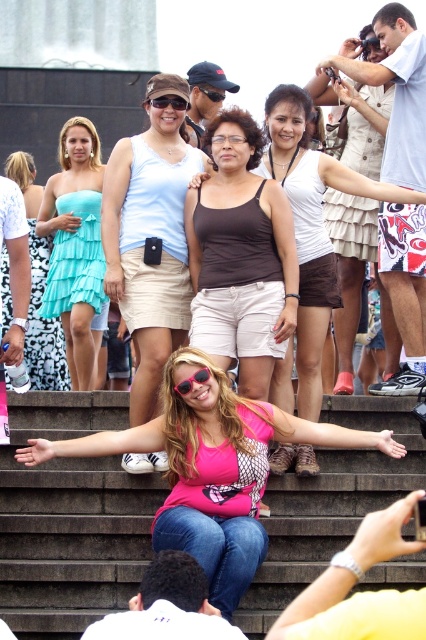
Is concrete stairs at center below pink matte sunglasses at center?

Correct, concrete stairs at center is located below pink matte sunglasses at center.

Who is more forward, (270, 554) or (210, 374)?

Point (210, 374)

Who is more distant from viewer, (304,513) or (192,378)?

The point (304,513) is more distant.

The width and height of the screenshot is (426, 640). I want to click on concrete stairs at center, so click(x=69, y=518).

Does teal satin dress at upper left appear on the left side of black plastic goggles at center?

Correct, you'll find teal satin dress at upper left to the left of black plastic goggles at center.

At what (x,y) coordinates should I click in order to perform the action: click on teal satin dress at upper left. Please return your answer as a coordinate pair (x, y). The image size is (426, 640). Looking at the image, I should click on (39, 288).

Does point (6, 269) come behind point (201, 90)?

No, (6, 269) is closer to viewer.

I want to click on teal satin dress at upper left, so click(39, 288).

How much distance is there between teal satin dress at upper left and pink matte sunglasses at center?

75.51 feet

Can you confirm if teal satin dress at upper left is thinner than pink matte sunglasses at center?

No.

Describe the element at coordinates (39, 288) in the screenshot. The height and width of the screenshot is (640, 426). I see `teal satin dress at upper left` at that location.

At what (x,y) coordinates should I click in order to perform the action: click on teal satin dress at upper left. Please return your answer as a coordinate pair (x, y). The width and height of the screenshot is (426, 640). Looking at the image, I should click on (39, 288).